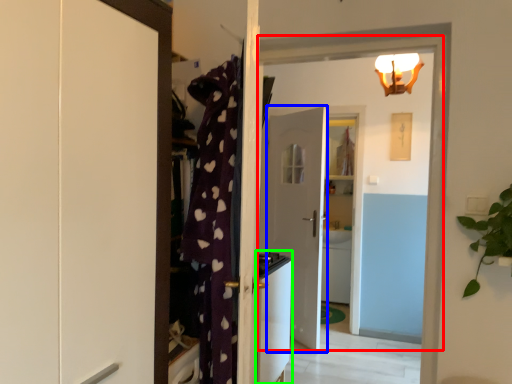
Question: Considering the real-world distances, which object is farthest from door (highlighted by a red box)? door (highlighted by a blue box) or appliance (highlighted by a green box)?

Choices:
 (A) door
 (B) appliance

Answer: (A)